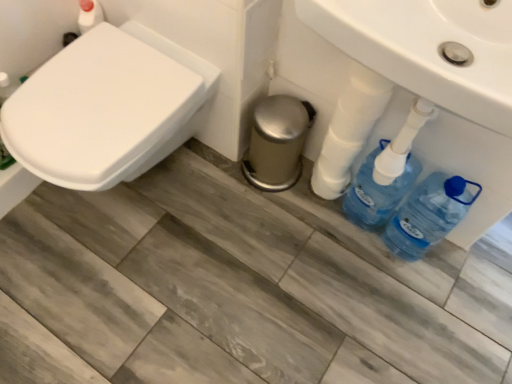
Question: Is white glossy sink at center to the right of white glossy toilet at left from the viewer's perspective?

Choices:
 (A) no
 (B) yes

Answer: (B)

Question: Does white glossy sink at center have a smaller size compared to white glossy toilet at left?

Choices:
 (A) yes
 (B) no

Answer: (A)

Question: Is white glossy sink at center aimed at white glossy toilet at left?

Choices:
 (A) yes
 (B) no

Answer: (B)

Question: From a real-world perspective, is white glossy sink at center physically below white glossy toilet at left?

Choices:
 (A) no
 (B) yes

Answer: (A)

Question: From the image's perspective, does white glossy sink at center appear lower than white glossy toilet at left?

Choices:
 (A) yes
 (B) no

Answer: (B)

Question: Is white glossy sink at center inside or outside of blue plastic bottles at lower right?

Choices:
 (A) inside
 (B) outside

Answer: (B)

Question: In the image, is white glossy sink at center positioned in front of or behind blue plastic bottles at lower right?

Choices:
 (A) behind
 (B) front

Answer: (B)

Question: Looking at the image, does white glossy sink at center seem bigger or smaller compared to blue plastic bottles at lower right?

Choices:
 (A) big
 (B) small

Answer: (A)

Question: In terms of height, does white glossy sink at center look taller or shorter compared to blue plastic bottles at lower right?

Choices:
 (A) tall
 (B) short

Answer: (B)

Question: Considering their positions, is blue plastic bottles at lower right located in front of or behind blue plastic bottle at lower right?

Choices:
 (A) behind
 (B) front

Answer: (A)

Question: Is blue plastic bottles at lower right spatially inside blue plastic bottle at lower right, or outside of it?

Choices:
 (A) inside
 (B) outside

Answer: (B)

Question: Is blue plastic bottles at lower right taller or shorter than blue plastic bottle at lower right?

Choices:
 (A) short
 (B) tall

Answer: (B)

Question: From the image's perspective, is blue plastic bottles at lower right located above or below blue plastic bottle at lower right?

Choices:
 (A) below
 (B) above

Answer: (B)

Question: Relative to white glossy sink at center, is white glossy toilet at left in front or behind?

Choices:
 (A) behind
 (B) front

Answer: (A)

Question: From a real-world perspective, is white glossy toilet at left positioned above or below white glossy sink at center?

Choices:
 (A) above
 (B) below

Answer: (B)